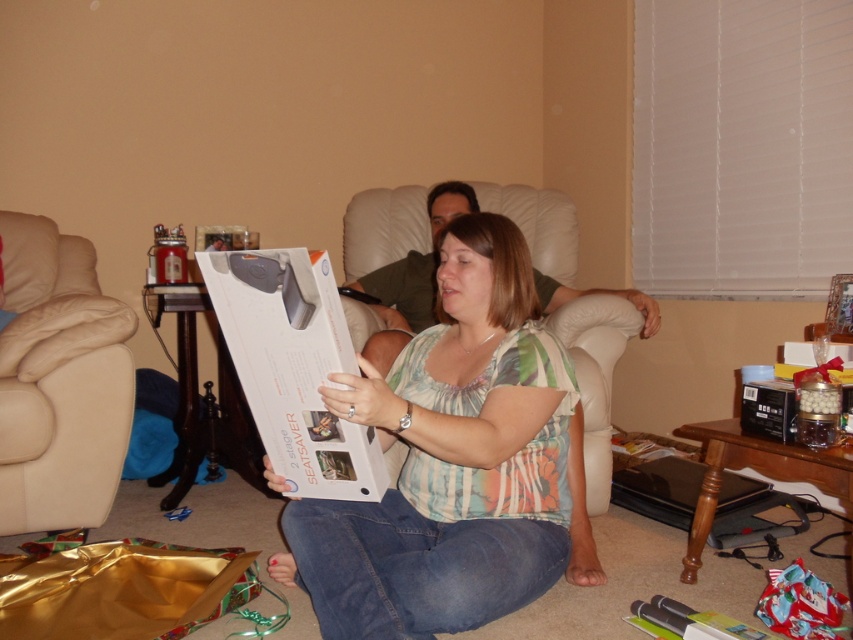
Question: Among these points, which one is farthest from the camera?

Choices:
 (A) (491, 388)
 (B) (259, 349)
 (C) (547, 294)
 (D) (38, 493)

Answer: (C)

Question: Can you confirm if white paperboard box at center is smaller than white cardboard box at center?

Choices:
 (A) no
 (B) yes

Answer: (A)

Question: Among these objects, which one is farthest from the camera?

Choices:
 (A) white paperboard box at center
 (B) leather at left

Answer: (B)

Question: Is white paperboard box at center wider than white cardboard box at center?

Choices:
 (A) yes
 (B) no

Answer: (A)

Question: Which object is positioned farthest from the white leather armchair at center?

Choices:
 (A) leather at left
 (B) white paperboard box at center
 (C) white cardboard box at center

Answer: (A)

Question: Does white paperboard box at center come behind leather at left?

Choices:
 (A) no
 (B) yes

Answer: (A)